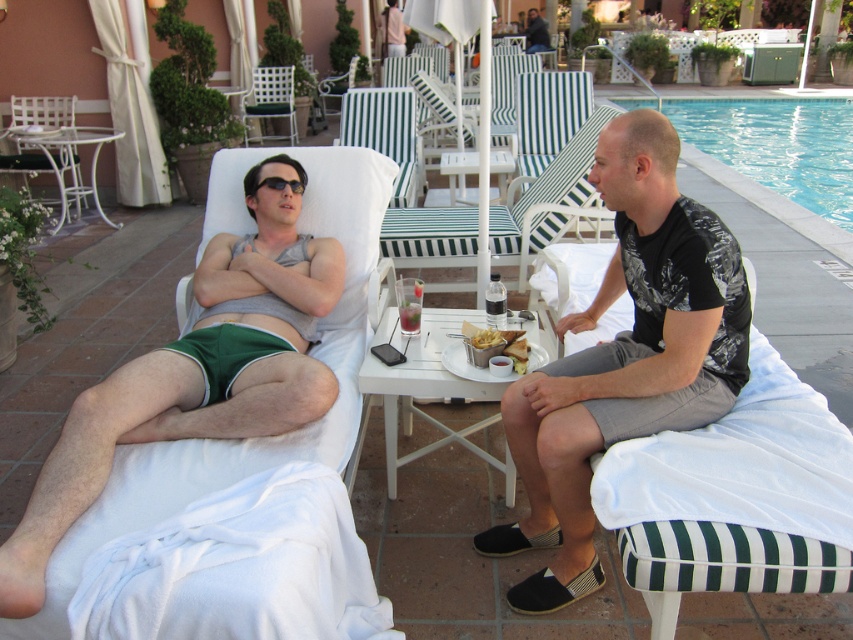
Does white metal chair at upper left appear over black plastic sunglasses at upper center?

Indeed, white metal chair at upper left is positioned over black plastic sunglasses at upper center.

Is white metal chair at upper left positioned at the back of black plastic sunglasses at upper center?

That is True.

Is point (70, 97) closer to camera compared to point (294, 180)?

No, it is behind (294, 180).

Where is `white metal chair at upper left`? white metal chair at upper left is located at coordinates (42, 112).

Does matte gray tank top at center have a lesser width compared to white wicker chair at upper center?

No, matte gray tank top at center is not thinner than white wicker chair at upper center.

Can you confirm if matte gray tank top at center is wider than white wicker chair at upper center?

Indeed, matte gray tank top at center has a greater width compared to white wicker chair at upper center.

What do you see at coordinates (196, 372) in the screenshot?
I see `matte gray tank top at center` at bounding box center [196, 372].

You are a GUI agent. You are given a task and a screenshot of the screen. Output one action in this format:
    pyautogui.click(x=<x>, y=<y>)
    Task: Click on the matte gray tank top at center
    
    Given the screenshot: What is the action you would take?
    pyautogui.click(x=196, y=372)

The image size is (853, 640). Describe the element at coordinates (778, 145) in the screenshot. I see `clear blue water at upper right` at that location.

Can you confirm if clear blue water at upper right is shorter than white wicker chair at upper center?

No, clear blue water at upper right is not shorter than white wicker chair at upper center.

Is point (804, 100) behind point (253, 97)?

Yes, it is behind point (253, 97).

Locate an element on the screen. This screenshot has width=853, height=640. clear blue water at upper right is located at coordinates tap(778, 145).